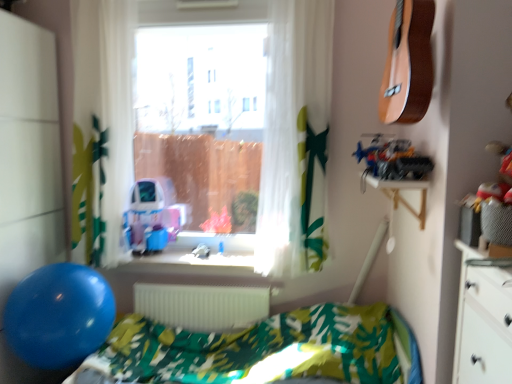
Question: From a real-world perspective, is blue rubber balloon at lower left physically located above or below white matte radiator at center?

Choices:
 (A) above
 (B) below

Answer: (A)

Question: Considering the relative positions of blue rubber balloon at lower left and white matte radiator at center in the image provided, is blue rubber balloon at lower left to the left or to the right of white matte radiator at center?

Choices:
 (A) right
 (B) left

Answer: (B)

Question: Estimate the real-world distances between objects in this image. Which object is closer to the wooden shelf at upper right?

Choices:
 (A) transparent glass window at center
 (B) blue rubber balloon at lower left
 (C) translucent white curtain at center, which is counted as the 2th curtain, starting from the left
 (D) green leaf-patterned fabric hospital bed at lower center
 (E) white/sheer curtain at left, the second curtain viewed from the right

Answer: (A)

Question: Estimate the real-world distances between objects in this image. Which object is closer to the green leaf-patterned fabric hospital bed at lower center?

Choices:
 (A) transparent glass window at center
 (B) white matte radiator at center
 (C) translucent white curtain at center, the first curtain when ordered from right to left
 (D) blue rubber balloon at lower left
 (E) white/sheer curtain at left, the second curtain viewed from the right

Answer: (B)